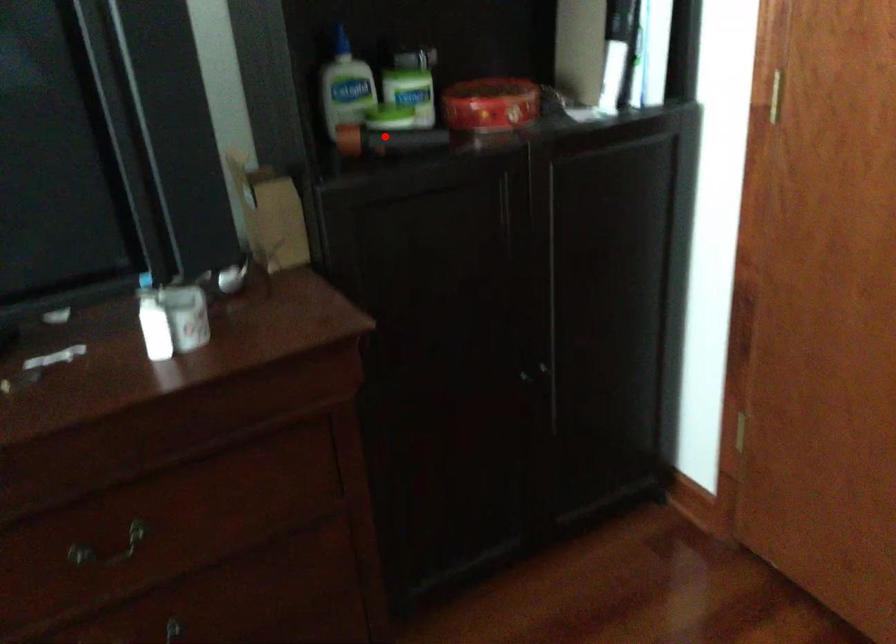
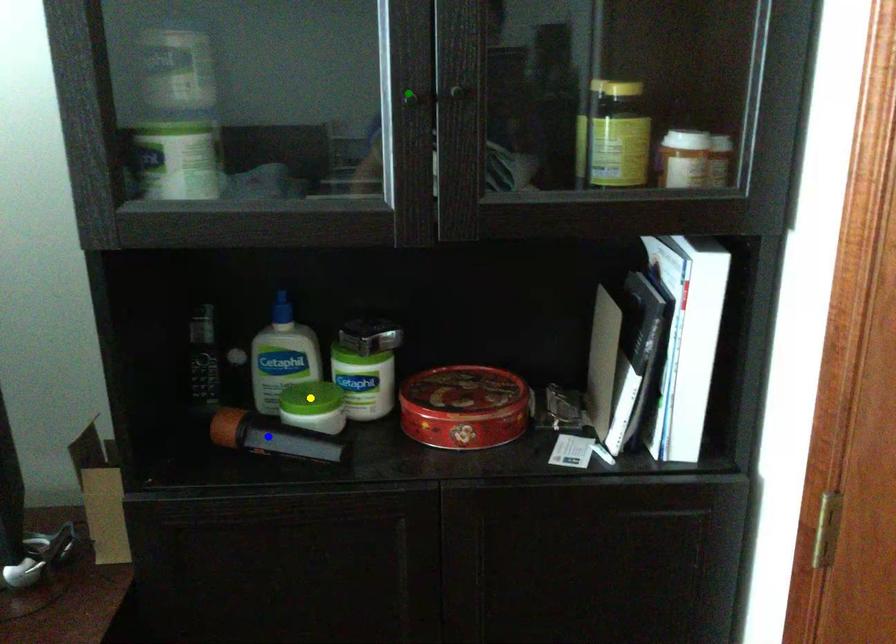
Question: I am providing you with two images of the same scene from different viewpoints. A red point is marked on the first image. You are given multiple points on the second image. Can you choose the point in image 2 that corresponds to the point in image 1?

Choices:
 (A) yellow point
 (B) blue point
 (C) green point

Answer: (B)